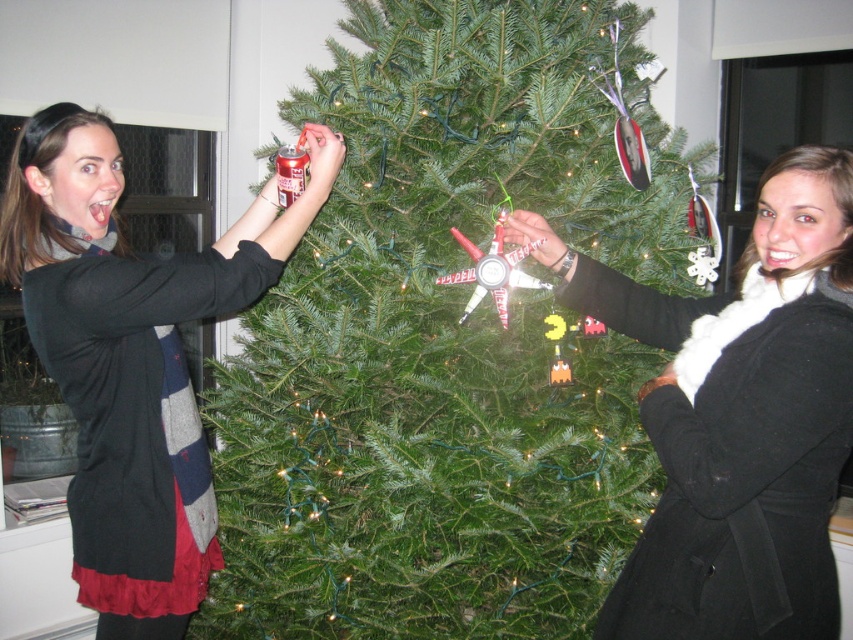
You are standing in front of the green matte christmas tree at center and want to see the white fur scarf at upper right. Can you see it without moving your head?

The white fur scarf at upper right is behind the green matte christmas tree at center, so you cannot see it without moving your head.

You are standing in front of the Christmas tree and notice the white fur scarf at upper right and the matte black sweater at left. Which item is closer to you?

The white fur scarf at upper right is closer to you because it is in front of the matte black sweater at left.